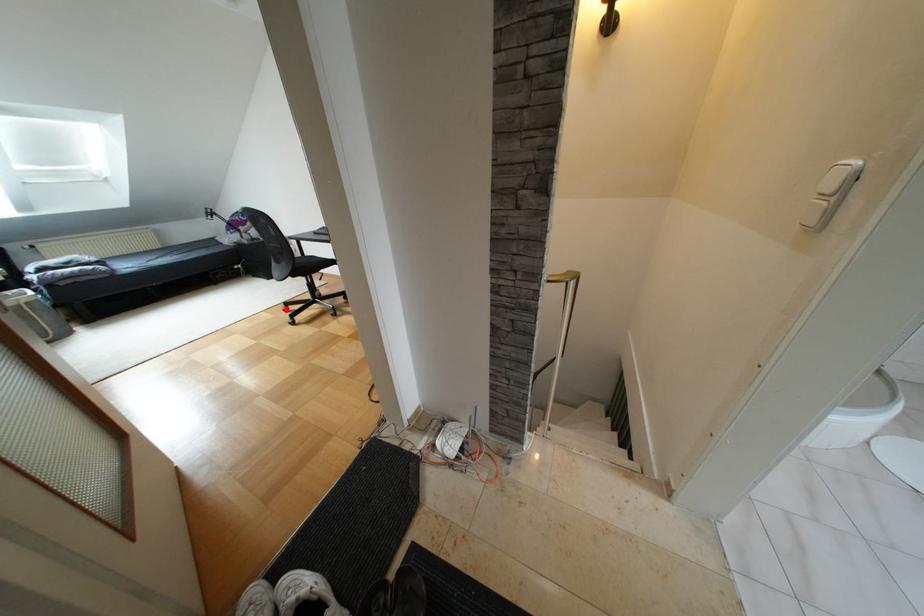
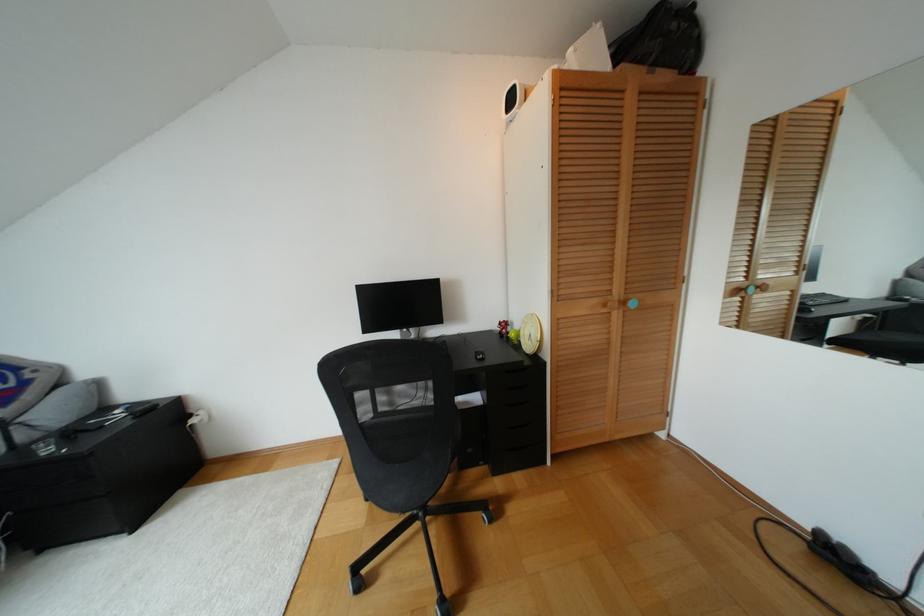
Where in the second image is the point corresponding to the highlighted location from the first image?

(359, 585)